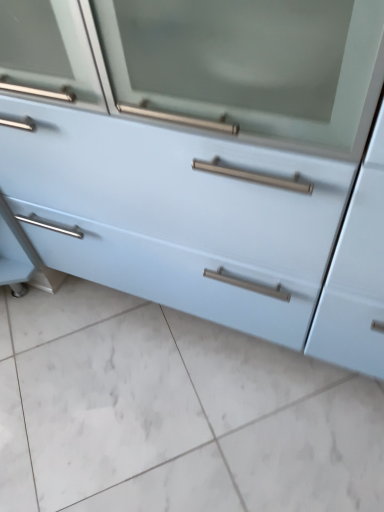
Where is `light blue matte cabinet at center`? This screenshot has width=384, height=512. light blue matte cabinet at center is located at coordinates (211, 161).

What do you see at coordinates (211, 161) in the screenshot? The height and width of the screenshot is (512, 384). I see `light blue matte cabinet at center` at bounding box center [211, 161].

Measure the distance between light blue matte cabinet at center and camera.

light blue matte cabinet at center is 17.74 inches away from camera.

Locate an element on the screen. white glossy tile at lower center is located at coordinates (173, 413).

Describe the element at coordinates (173, 413) in the screenshot. I see `white glossy tile at lower center` at that location.

The image size is (384, 512). Find the location of `light blue matte cabinet at center`. light blue matte cabinet at center is located at coordinates (211, 161).

Which is more to the right, light blue matte cabinet at center or white glossy tile at lower center?

light blue matte cabinet at center.

Considering their positions, is light blue matte cabinet at center located in front of or behind white glossy tile at lower center?

Clearly, light blue matte cabinet at center is in front of white glossy tile at lower center.

Which is nearer, (369, 359) or (292, 384)?

The point (369, 359) is more forward.

From the image's perspective, between light blue matte cabinet at center and white glossy tile at lower center, who is located below?

white glossy tile at lower center is shown below in the image.

Based on the photo, from a real-world perspective, is light blue matte cabinet at center physically located above or below white glossy tile at lower center?

In terms of real-world spatial position, light blue matte cabinet at center is above white glossy tile at lower center.

Is light blue matte cabinet at center wider than white glossy tile at lower center?

In fact, light blue matte cabinet at center might be narrower than white glossy tile at lower center.

Between light blue matte cabinet at center and white glossy tile at lower center, which one has more height?

With more height is light blue matte cabinet at center.

Considering the relative sizes of light blue matte cabinet at center and white glossy tile at lower center in the image provided, is light blue matte cabinet at center bigger than white glossy tile at lower center?

Yes.

Is light blue matte cabinet at center situated inside white glossy tile at lower center or outside?

light blue matte cabinet at center lies outside white glossy tile at lower center.

Is there a large distance between light blue matte cabinet at center and white glossy tile at lower center?

They are positioned close to each other.

Is white glossy tile at lower center at the back of light blue matte cabinet at center?

light blue matte cabinet at center is not turned away from white glossy tile at lower center.

How different are the orientations of light blue matte cabinet at center and white glossy tile at lower center in degrees?

The angle between the facing direction of light blue matte cabinet at center and the facing direction of white glossy tile at lower center is 89.8 degrees.

The height and width of the screenshot is (512, 384). In order to click on the chest of drawers above the white glossy tile at lower center (from the image's perspective) in this screenshot , I will do `click(211, 161)`.

Is white glossy tile at lower center to the left or to the right of light blue matte cabinet at center in the image?

In the image, white glossy tile at lower center appears on the left side of light blue matte cabinet at center.

Which object is more forward, white glossy tile at lower center or light blue matte cabinet at center?

light blue matte cabinet at center is more forward.

Does point (82, 395) appear closer or farther from the camera than point (19, 172)?

Point (82, 395).

From the image's perspective, which one is positioned lower, white glossy tile at lower center or light blue matte cabinet at center?

white glossy tile at lower center appears lower in the image.

Consider the image. From a real-world perspective, is white glossy tile at lower center positioned under light blue matte cabinet at center based on gravity?

Yes, from a real-world perspective, white glossy tile at lower center is beneath light blue matte cabinet at center.

In the scene shown: Considering the sizes of white glossy tile at lower center and light blue matte cabinet at center in the image, is white glossy tile at lower center wider or thinner than light blue matte cabinet at center?

white glossy tile at lower center is wider than light blue matte cabinet at center.

Considering the sizes of white glossy tile at lower center and light blue matte cabinet at center in the image, is white glossy tile at lower center taller or shorter than light blue matte cabinet at center?

Considering their sizes, white glossy tile at lower center has less height than light blue matte cabinet at center.

From the picture: Does white glossy tile at lower center have a larger size compared to light blue matte cabinet at center?

Actually, white glossy tile at lower center might be smaller than light blue matte cabinet at center.

Is white glossy tile at lower center located outside light blue matte cabinet at center?

Yes.

Does white glossy tile at lower center touch light blue matte cabinet at center?

white glossy tile at lower center is not next to light blue matte cabinet at center, and they're not touching.

Is white glossy tile at lower center looking in the opposite direction of light blue matte cabinet at center?

No, white glossy tile at lower center is not facing away from light blue matte cabinet at center.

Can you tell me how much white glossy tile at lower center and light blue matte cabinet at center differ in facing direction?

The angular difference between white glossy tile at lower center and light blue matte cabinet at center is 89.8 degrees.

You are a GUI agent. You are given a task and a screenshot of the screen. Output one action in this format:
    pyautogui.click(x=<x>, y=<y>)
    Task: Click on the ceramic tile lying behind the light blue matte cabinet at center
    The width and height of the screenshot is (384, 512).
    Given the screenshot: What is the action you would take?
    pyautogui.click(x=173, y=413)

Identify the location of chest of drawers above the white glossy tile at lower center (from a real-world perspective). The width and height of the screenshot is (384, 512). (211, 161).

Identify the location of ceramic tile that appears below the light blue matte cabinet at center (from a real-world perspective). The image size is (384, 512). (173, 413).